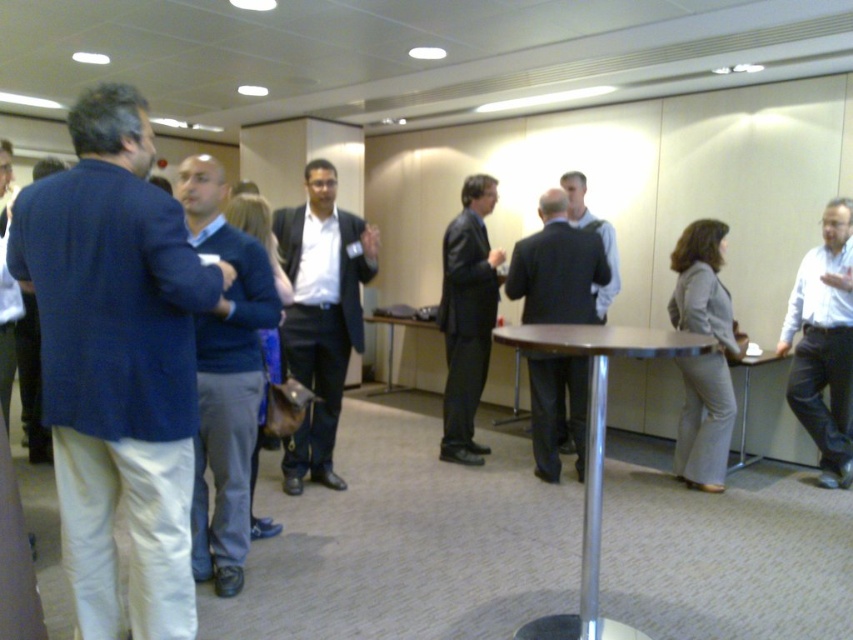
You are standing at the entrance of the room and see the dark suit at center and the gray fabric suit at right. Which person is closer to you?

The dark suit at center is closer to the viewer than the gray fabric suit at right.